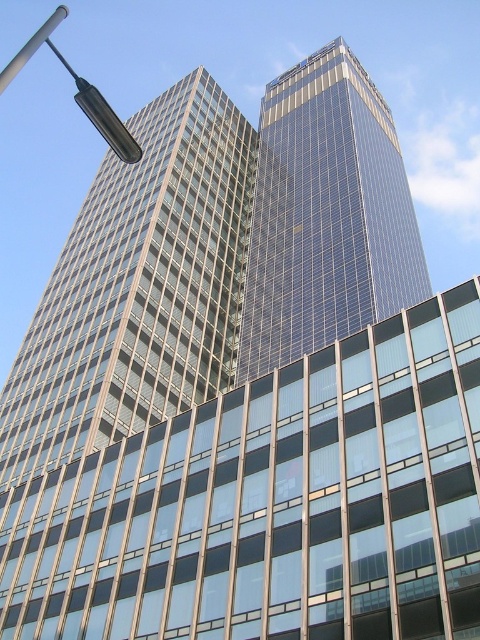
Does point (134, 154) come in front of point (36, 40)?

Yes, it is in front of point (36, 40).

What are the coordinates of `black glass lamp post at upper left` in the screenshot? It's located at (78, 92).

Describe the element at coordinates (78, 92) in the screenshot. I see `black glass lamp post at upper left` at that location.

You are a GUI agent. You are given a task and a screenshot of the screen. Output one action in this format:
    pyautogui.click(x=<x>, y=<y>)
    Task: Click on the black glass lamp post at upper left
    This screenshot has width=480, height=640.
    Given the screenshot: What is the action you would take?
    pyautogui.click(x=78, y=92)

Does glassy reflective skyscraper at center appear on the right side of metallic pole at upper left?

Yes, glassy reflective skyscraper at center is to the right of metallic pole at upper left.

Does point (288, 80) come behind point (33, 35)?

No, it is not.

Locate an element on the screen. The image size is (480, 640). glassy reflective skyscraper at center is located at coordinates (325, 216).

Who is more distant from viewer, (336, 141) or (76, 84)?

Positioned behind is point (76, 84).

Does glassy reflective skyscraper at center appear on the left side of black glass lamp post at upper left?

No, glassy reflective skyscraper at center is not to the left of black glass lamp post at upper left.

This screenshot has width=480, height=640. Find the location of `glassy reflective skyscraper at center`. glassy reflective skyscraper at center is located at coordinates (325, 216).